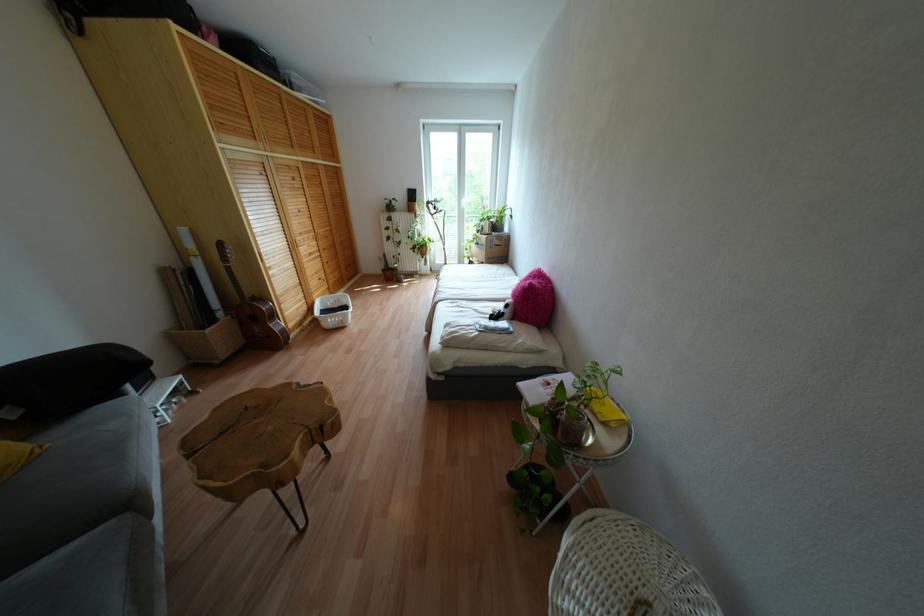
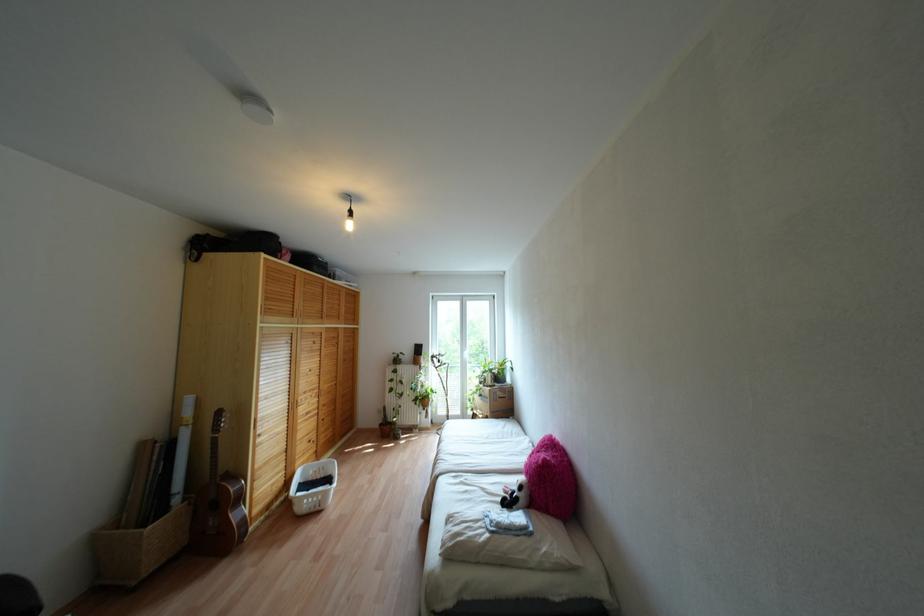
Find the pixel in the second image that matches point 320,231 in the first image.

(324, 387)